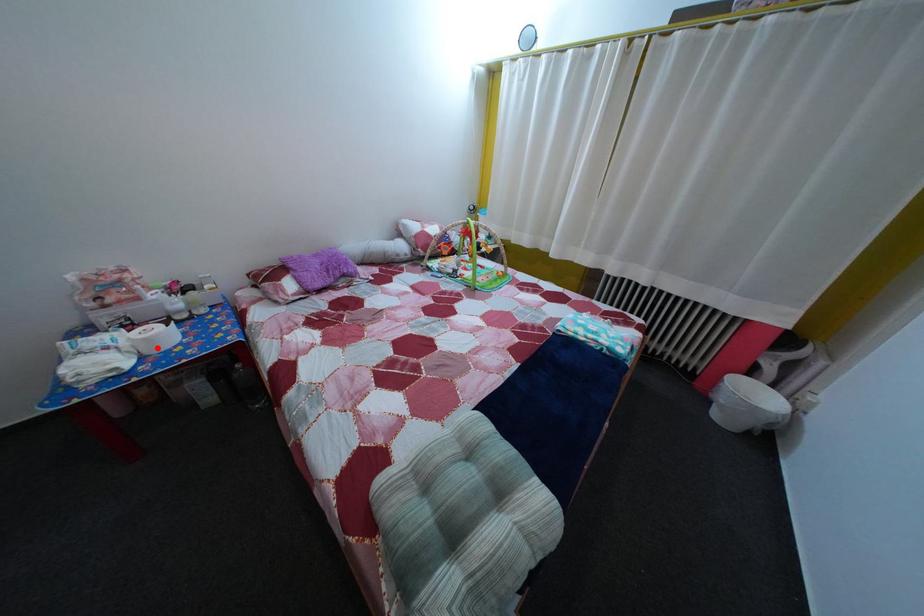
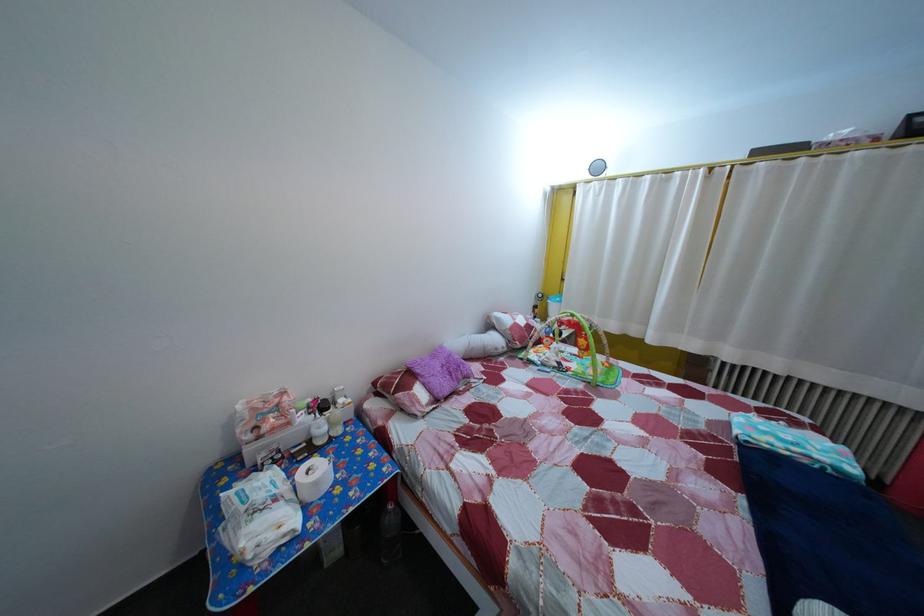
Question: I am providing you with two images of the same scene from different viewpoints. Given a red point in image1, look at the same physical point in image2. Is it:

Choices:
 (A) Closer to the viewpoint
 (B) Farther from the viewpoint

Answer: (A)